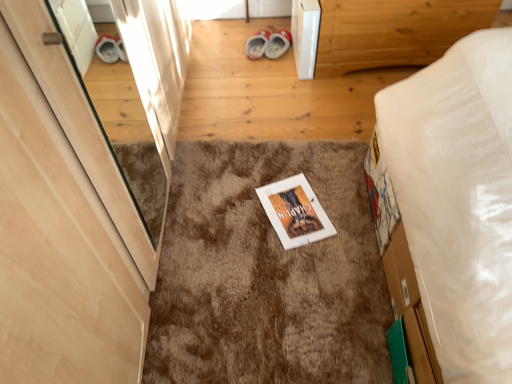
At what (x,y) coordinates should I click in order to perform the action: click on free space in front of red suede shoes at center. Please return your answer as a coordinate pair (x, y). Looking at the image, I should click on (257, 56).